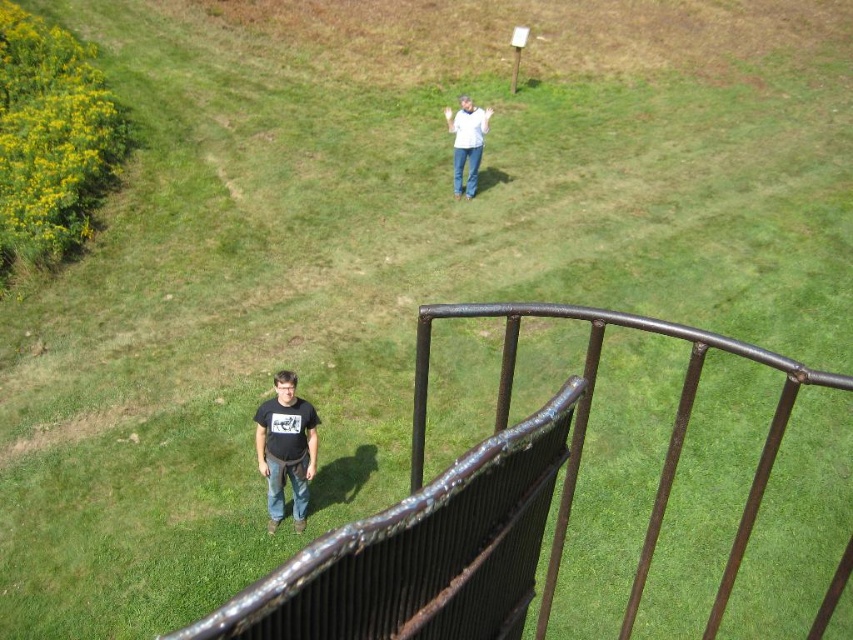
Between black matte t-shirt at lower center and blue denim jeans at lower center, which one is positioned lower?

blue denim jeans at lower center is lower down.

Is black matte t-shirt at lower center taller than blue denim jeans at lower center?

Yes, black matte t-shirt at lower center is taller than blue denim jeans at lower center.

Is point (270, 518) closer to viewer compared to point (297, 460)?

No, it is not.

Find the location of `black matte t-shirt at lower center`. black matte t-shirt at lower center is located at coordinates (286, 449).

Can you confirm if rusty metal fence at lower right is wider than blue denim jeans at lower center?

Indeed, rusty metal fence at lower right has a greater width compared to blue denim jeans at lower center.

Is rusty metal fence at lower right thinner than blue denim jeans at lower center?

No, rusty metal fence at lower right is not thinner than blue denim jeans at lower center.

Between point (718, 346) and point (285, 481), which one is positioned behind?

Point (285, 481)

Where is `rusty metal fence at lower right`? The width and height of the screenshot is (853, 640). rusty metal fence at lower right is located at coordinates (587, 419).

Is white matte shirt at upper center taller than denim at center?

Correct, white matte shirt at upper center is much taller as denim at center.

Locate an element on the screen. This screenshot has height=640, width=853. white matte shirt at upper center is located at coordinates (466, 141).

This screenshot has height=640, width=853. Identify the location of white matte shirt at upper center. (466, 141).